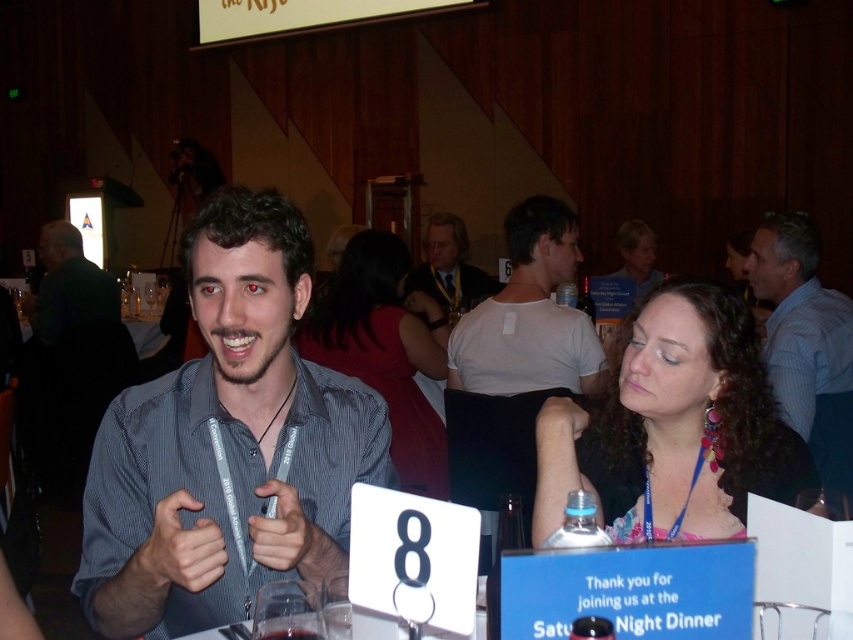
Question: From the image, what is the correct spatial relationship of shiny blue shirt at center in relation to blue striped shirt at upper right?

Choices:
 (A) above
 (B) below

Answer: (B)

Question: Is matte gray shirt at center behind matte black dress at center?

Choices:
 (A) yes
 (B) no

Answer: (A)

Question: Which object is farther from the camera taking this photo?

Choices:
 (A) blue striped shirt at upper right
 (B) light brown leather jacket at center

Answer: (B)

Question: Does blue striped shirt at upper right appear over light brown leather jacket at center?

Choices:
 (A) no
 (B) yes

Answer: (A)

Question: Estimate the real-world distances between objects in this image. Which object is farther from the matte black dress at center?

Choices:
 (A) white matte shirt at center
 (B) matte black hair at upper center

Answer: (B)

Question: Which point is farther to the camera?

Choices:
 (A) (287, 636)
 (B) (589, 276)
 (C) (631, 266)
 (D) (445, 220)

Answer: (C)